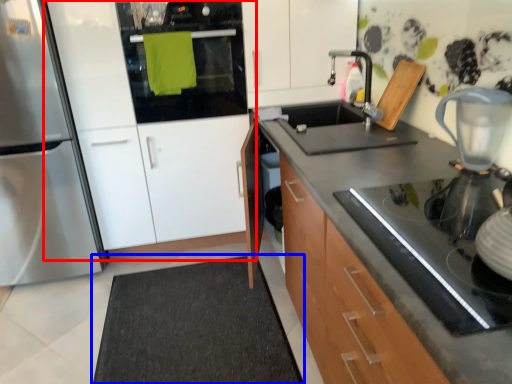
Question: Which point is further to the camera, cabinetry (highlighted by a red box) or doormat (highlighted by a blue box)?

Choices:
 (A) cabinetry
 (B) doormat

Answer: (A)